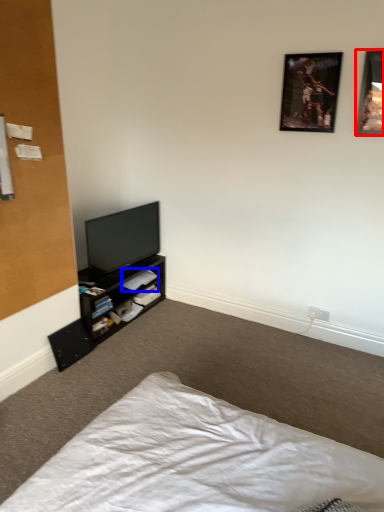
Question: Which object is further to the camera taking this photo, picture frame (highlighted by a red box) or book (highlighted by a blue box)?

Choices:
 (A) picture frame
 (B) book

Answer: (B)